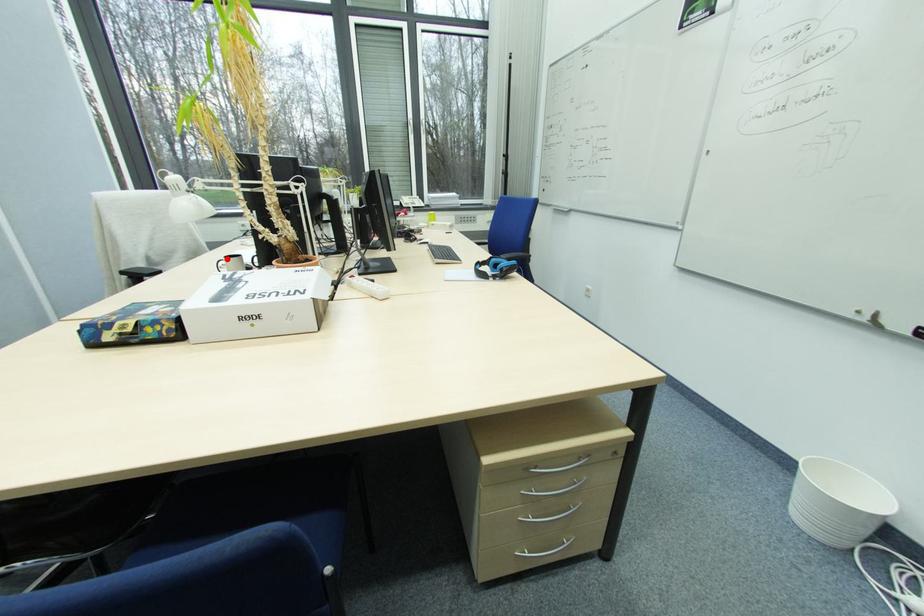
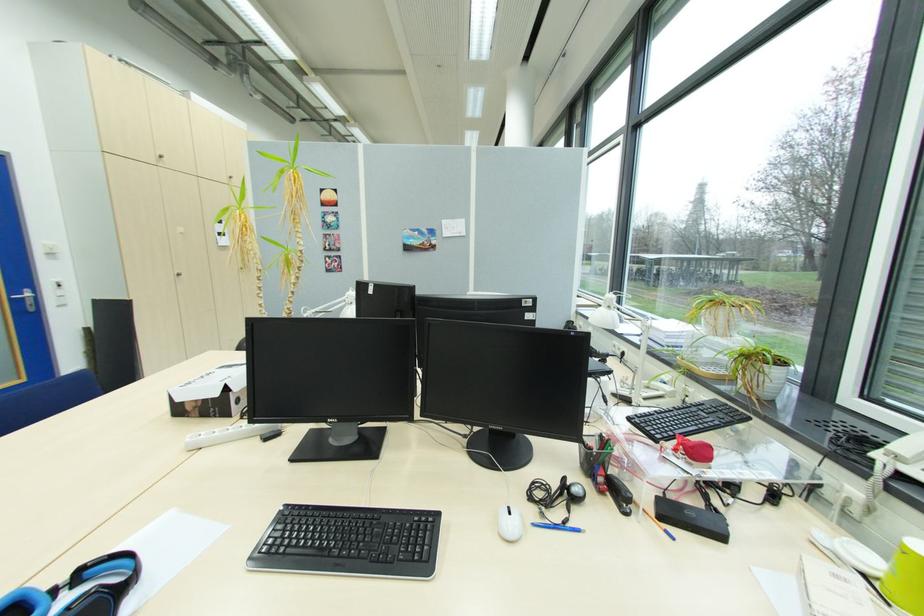
Question: I am providing you with two images of the same scene from different viewpoints. A red point is marked on the first image. At the location where the point appears in image 1, is it still visible in image 2?

Choices:
 (A) Yes
 (B) No

Answer: (B)